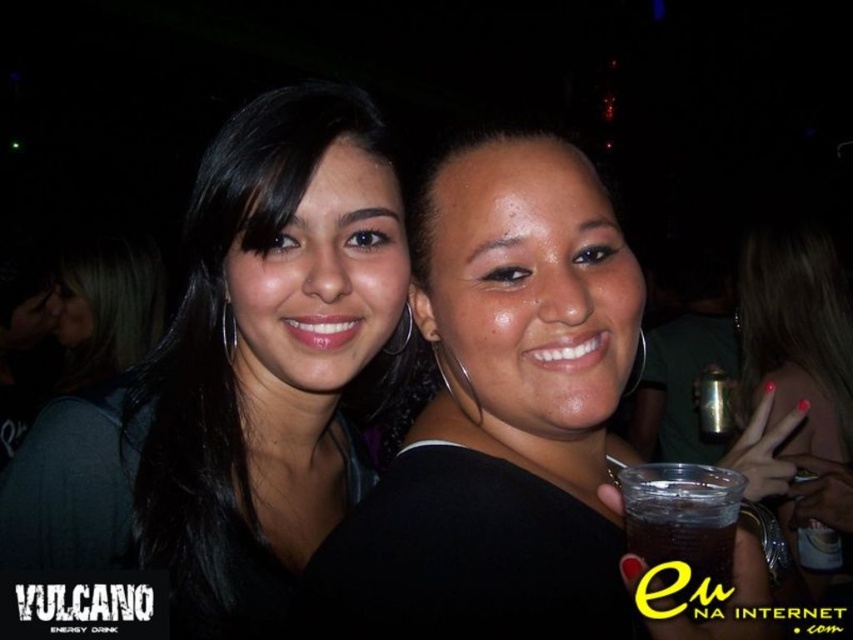
Question: Is the position of black hair at center more distant than that of translucent plastic cup at lower right?

Choices:
 (A) yes
 (B) no

Answer: (A)

Question: Does black hair at center lie behind translucent plastic cup at lower right?

Choices:
 (A) no
 (B) yes

Answer: (B)

Question: Which of the following is the farthest from the observer?

Choices:
 (A) black hair at center
 (B) matte black shirt at center
 (C) translucent plastic cup at lower right

Answer: (A)

Question: Is black hair at center wider than translucent plastic cup at lower right?

Choices:
 (A) yes
 (B) no

Answer: (A)

Question: Among these points, which one is nearest to the camera?

Choices:
 (A) (668, 476)
 (B) (590, 483)

Answer: (A)

Question: Which of these objects is positioned closest to the black hair at center?

Choices:
 (A) matte black shirt at center
 (B) translucent plastic cup at lower right

Answer: (A)